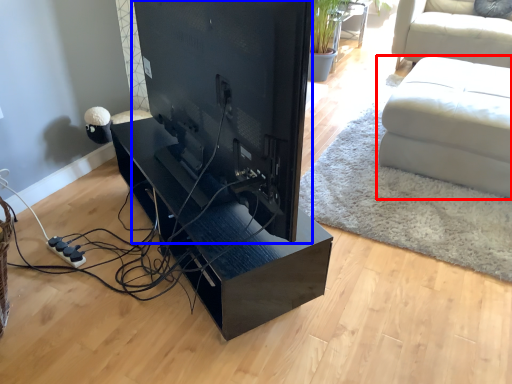
Question: Which object is closer to the camera taking this photo, studio couch (highlighted by a red box) or desktop computer (highlighted by a blue box)?

Choices:
 (A) studio couch
 (B) desktop computer

Answer: (B)